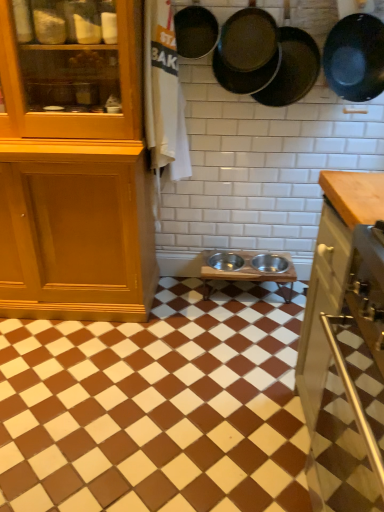
At what (x,y) coordinates should I click in order to perform the action: click on free space above metallic silver bowls at center (from a real-world perspective). Please return your answer as a coordinate pair (x, y). This screenshot has width=384, height=512. Looking at the image, I should click on (159, 361).